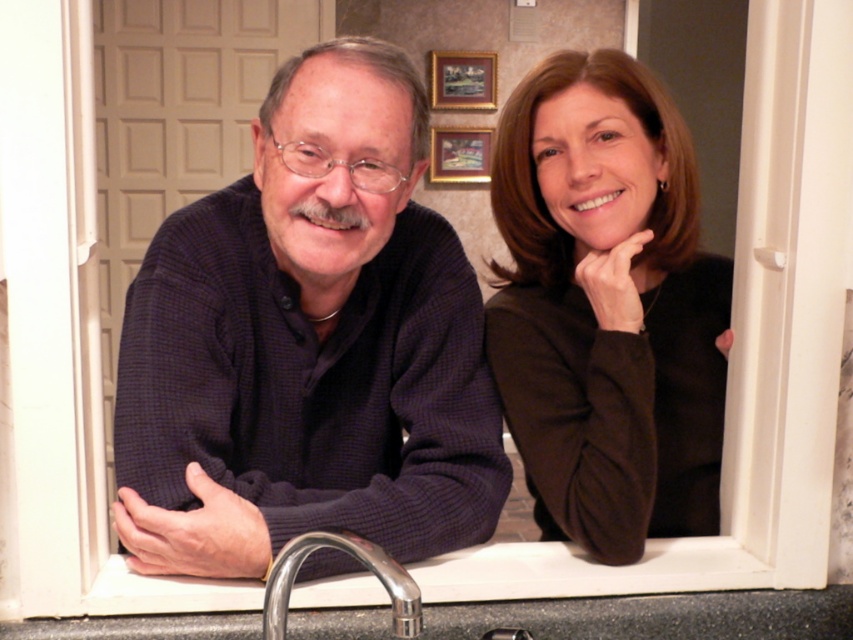
Question: Which point is farther from the camera taking this photo?

Choices:
 (A) (520, 353)
 (B) (270, 605)
 (C) (461, 301)

Answer: (A)

Question: Which object is closer to the camera taking this photo?

Choices:
 (A) matte brown sweater at right
 (B) dark blue sweater at center
 (C) polished chrome faucet at lower center

Answer: (C)

Question: Considering the real-world distances, which object is farthest from the matte brown sweater at right?

Choices:
 (A) dark blue sweater at center
 (B) polished chrome faucet at lower center

Answer: (B)

Question: Can you confirm if dark blue sweater at center is positioned to the right of polished chrome faucet at lower center?

Choices:
 (A) no
 (B) yes

Answer: (B)

Question: Is matte brown sweater at right to the right of polished chrome faucet at lower center from the viewer's perspective?

Choices:
 (A) yes
 (B) no

Answer: (A)

Question: Can you confirm if dark blue sweater at center is positioned below matte brown sweater at right?

Choices:
 (A) yes
 (B) no

Answer: (A)